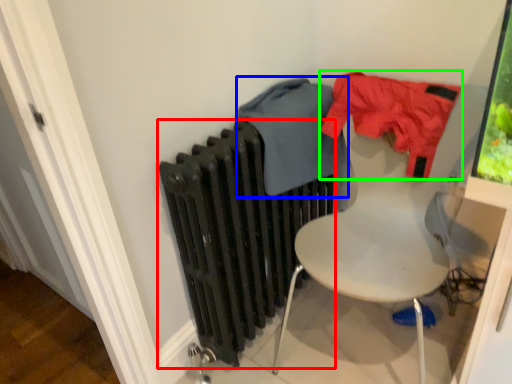
Question: Which object is positioned closest to radiator (highlighted by a red box)? Select from clothing (highlighted by a blue box) and clothing (highlighted by a green box).

Choices:
 (A) clothing
 (B) clothing

Answer: (A)